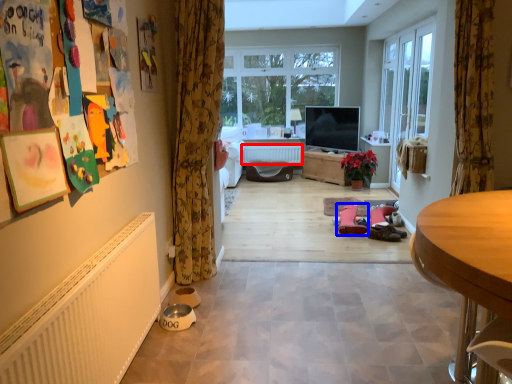
Question: Which point is closer to the camera, radiator (highlighted by a red box) or footwear (highlighted by a blue box)?

Choices:
 (A) radiator
 (B) footwear

Answer: (B)